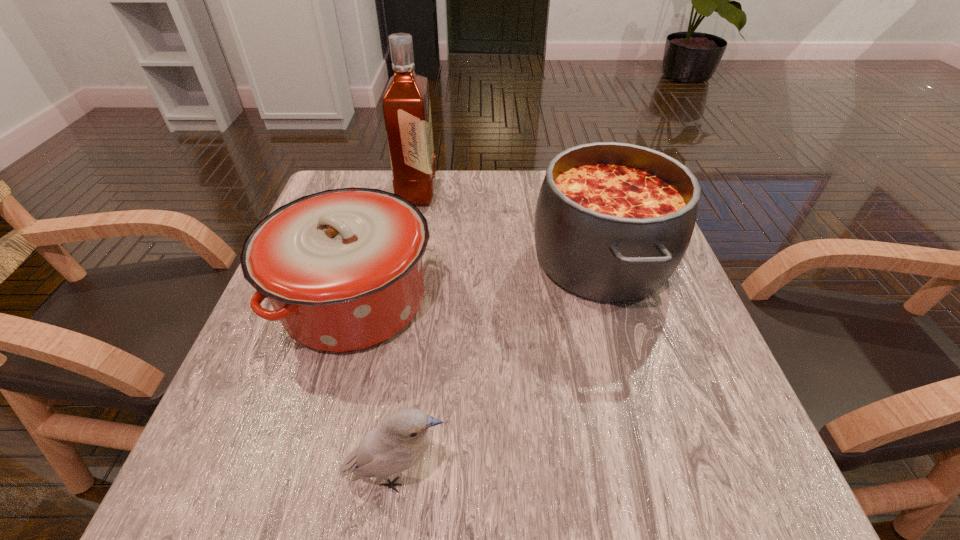
Find the location of `liquor`. liquor is located at coordinates (406, 106).

Locate an element on the screen. The height and width of the screenshot is (540, 960). the right casserole is located at coordinates (613, 221).

What are the coordinates of `the left casserole` in the screenshot? It's located at (342, 268).

At what (x,y) coordinates should I click in order to perform the action: click on the nearest object. Please return your answer as a coordinate pair (x, y). Looking at the image, I should click on (399, 443).

What are the coordinates of `the shortest object` in the screenshot? It's located at coord(399,443).

Find the location of a particular element. vacant space located on the front label of the tallest object is located at coordinates (524, 193).

Locate an element on the screen. vacant space located on the left of the rightmost object is located at coordinates (412, 260).

You are a GUI agent. You are given a task and a screenshot of the screen. Output one action in this format:
    pyautogui.click(x=<x>, y=<y>)
    Task: Click on the vacant area located 0.180m on the back of the left casserole
    The image size is (960, 540).
    Given the screenshot: What is the action you would take?
    pyautogui.click(x=382, y=202)

Locate an element on the screen. blank space located 0.190m at the beak of the nearest object is located at coordinates (582, 475).

Identify the location of liquor at the far edge. This screenshot has height=540, width=960. (406, 106).